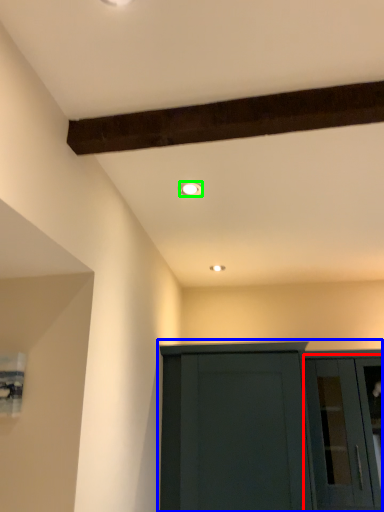
Question: Considering the real-world distances, which object is closest to glass door (highlighted by a red box)? cupboard (highlighted by a blue box) or lighting (highlighted by a green box).

Choices:
 (A) cupboard
 (B) lighting

Answer: (A)